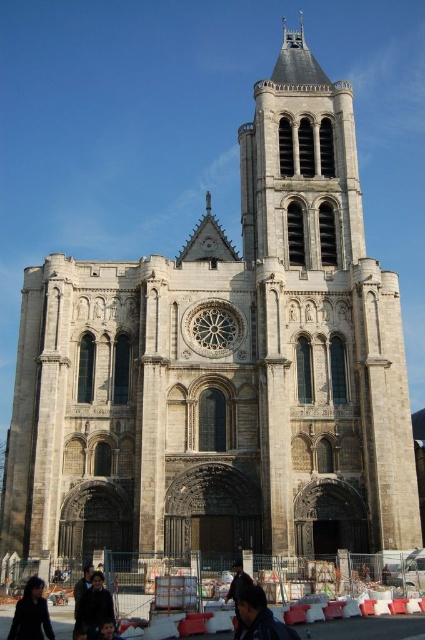
You are standing in front of the cathedral and see the dark blue jacket at lower left and the dark brown leather jacket at center. Which jacket is shorter in height?

The dark blue jacket at lower left is shorter in height compared to the dark brown leather jacket at center.

You are standing in front of the cathedral and want to pick up the dark brown leather jacket at center and the dark brown leather jacket at lower center. Which jacket is farther from your current position?

The dark brown leather jacket at center is 7.18 meters away from the dark brown leather jacket at lower center, so the dark brown leather jacket at center is farther away from your current position.